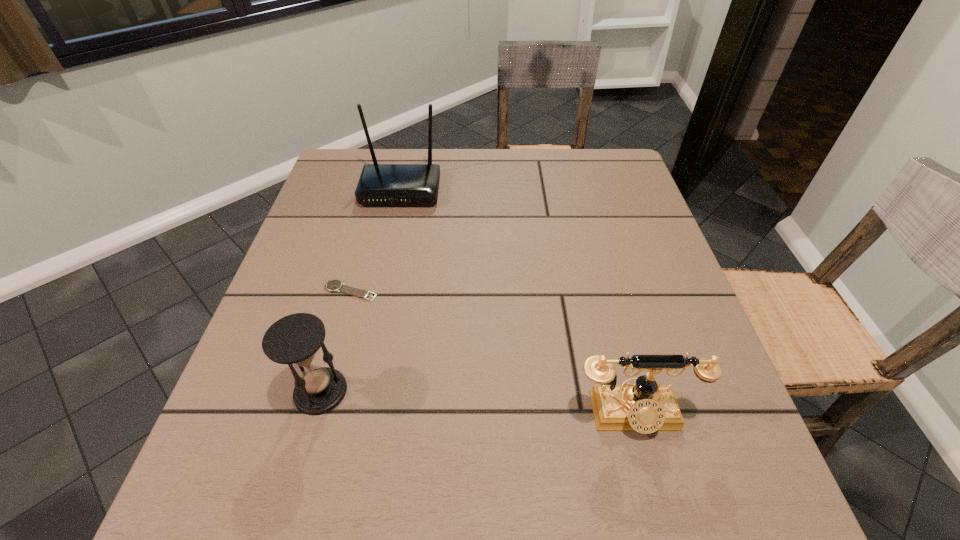
The height and width of the screenshot is (540, 960). I want to click on router present at the left edge, so click(x=379, y=184).

This screenshot has height=540, width=960. Identify the location of hourglass located at the left edge. (295, 339).

Identify the location of watch at the left edge. (332, 285).

The height and width of the screenshot is (540, 960). I want to click on object that is at the right edge, so (645, 407).

Find the location of `object that is at the far left corner`. object that is at the far left corner is located at coordinates (379, 184).

Where is `vacant space at the far edge`? The image size is (960, 540). vacant space at the far edge is located at coordinates (460, 153).

This screenshot has height=540, width=960. What are the coordinates of `vacant space at the near edge of the desktop` in the screenshot? It's located at (573, 509).

The height and width of the screenshot is (540, 960). In the image, there is a desktop. Identify the location of vacant space at the left edge. (255, 396).

Identify the location of vacant space at the right edge. The width and height of the screenshot is (960, 540). (650, 301).

Image resolution: width=960 pixels, height=540 pixels. In the image, there is a desktop. Identify the location of vacant space at the near left corner. (291, 522).